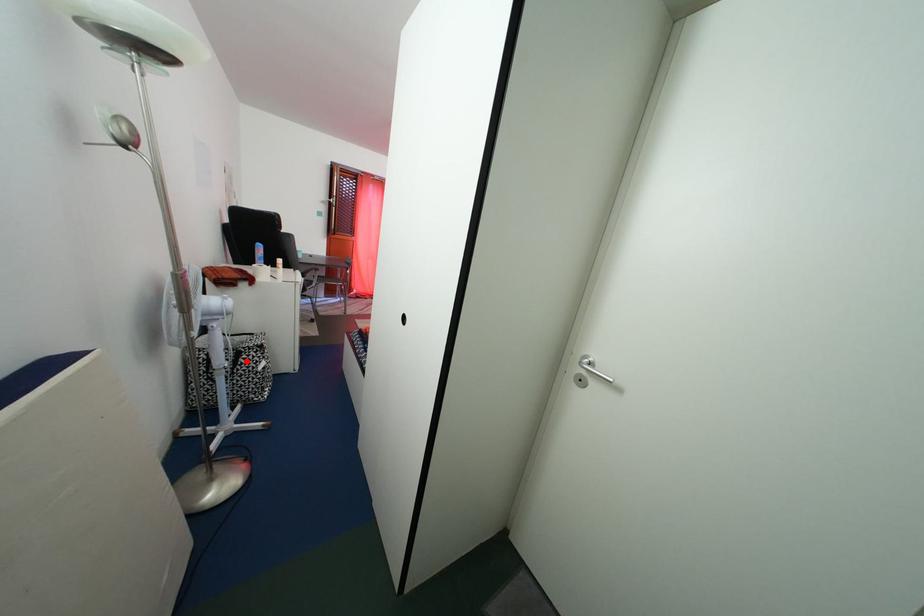
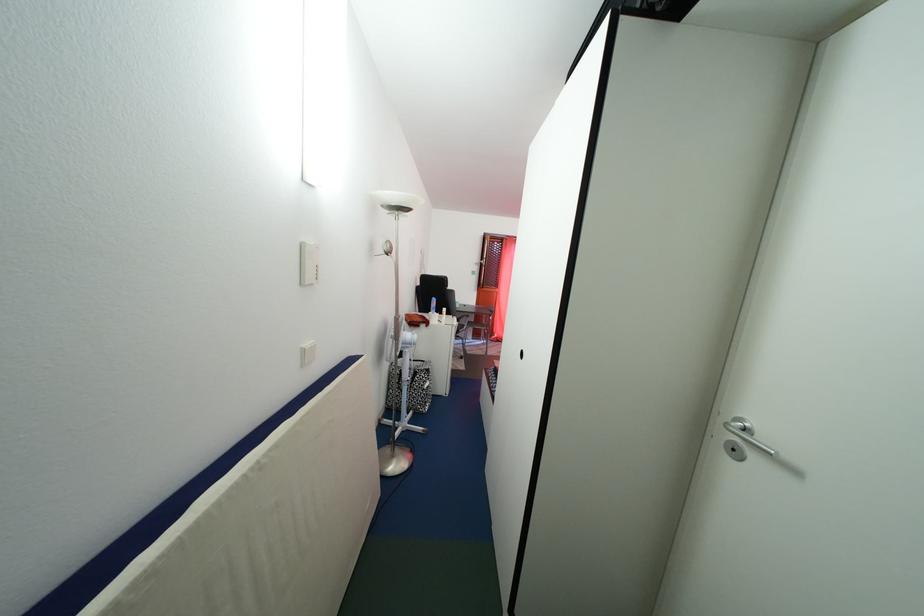
The point at the highlighted location is marked in the first image. Where is the corresponding point in the second image?

(423, 381)